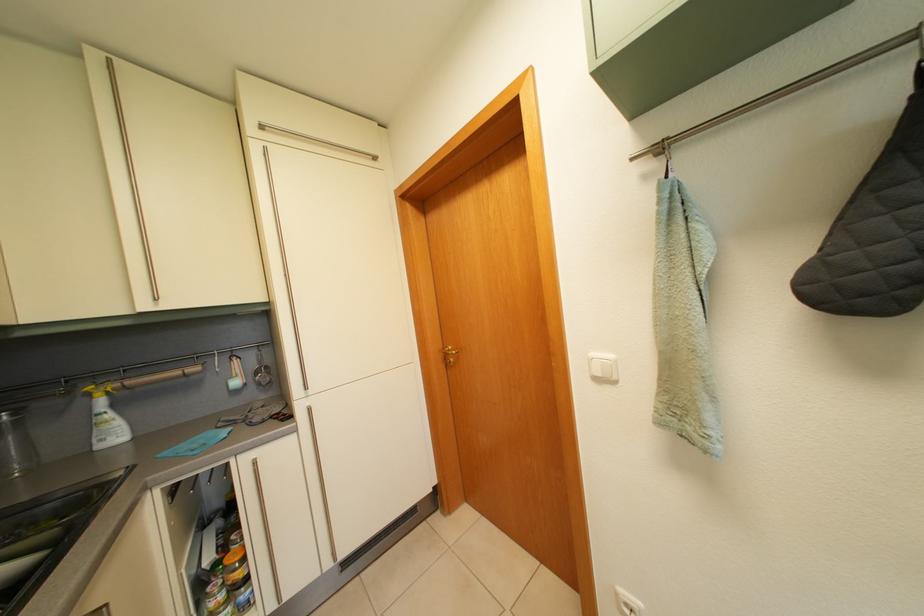
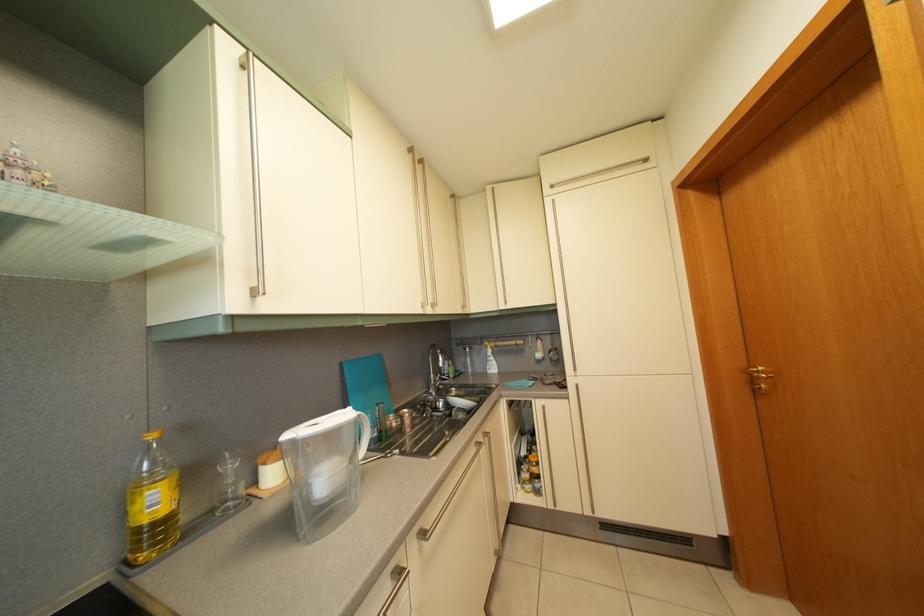
Question: How did the camera likely rotate?

Choices:
 (A) Left
 (B) Right
 (C) Up
 (D) Down

Answer: (A)